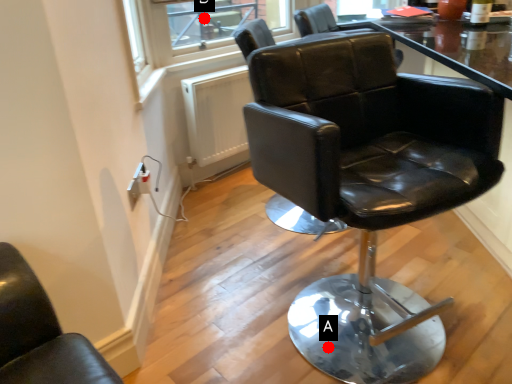
Question: Two points are circled on the image, labeled by A and B beside each circle. Which point is further to the camera?

Choices:
 (A) A is further
 (B) B is further

Answer: (B)